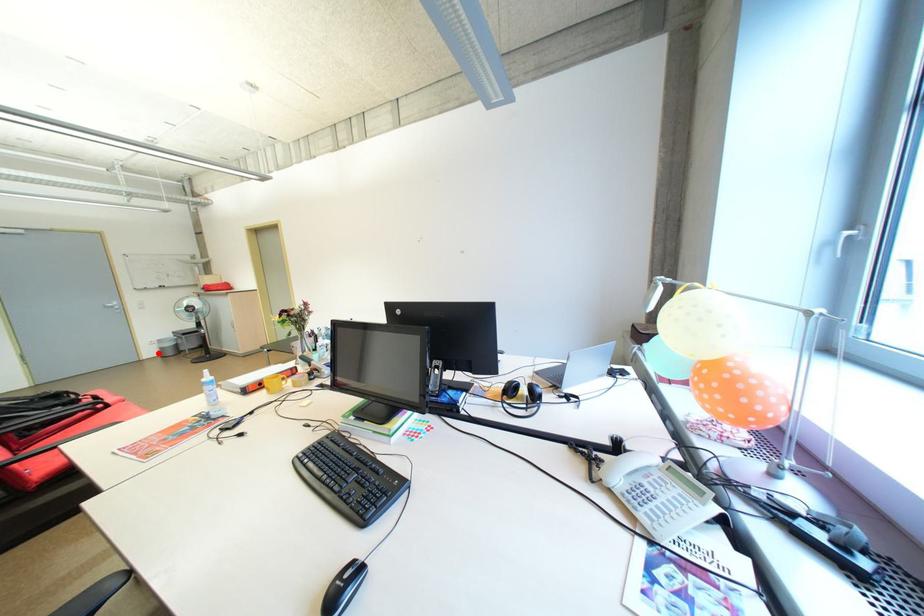
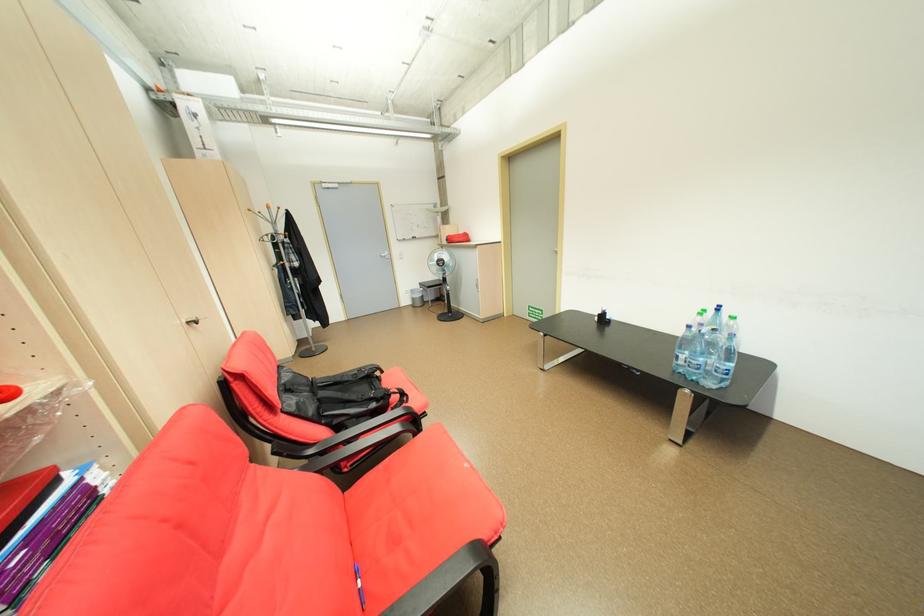
The point at the highlighted location is marked in the first image. Where is the corresponding point in the second image?

(415, 302)